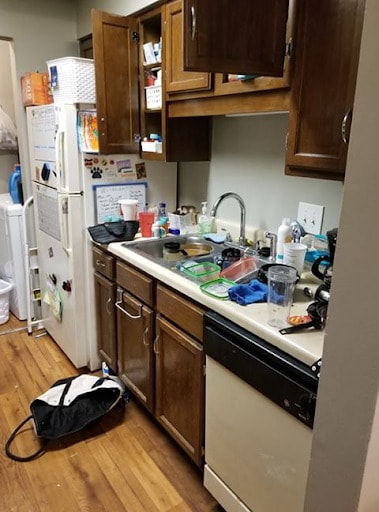
Locate an element on the screen. This screenshot has height=512, width=379. lightswitch is located at coordinates (313, 219), (303, 220).